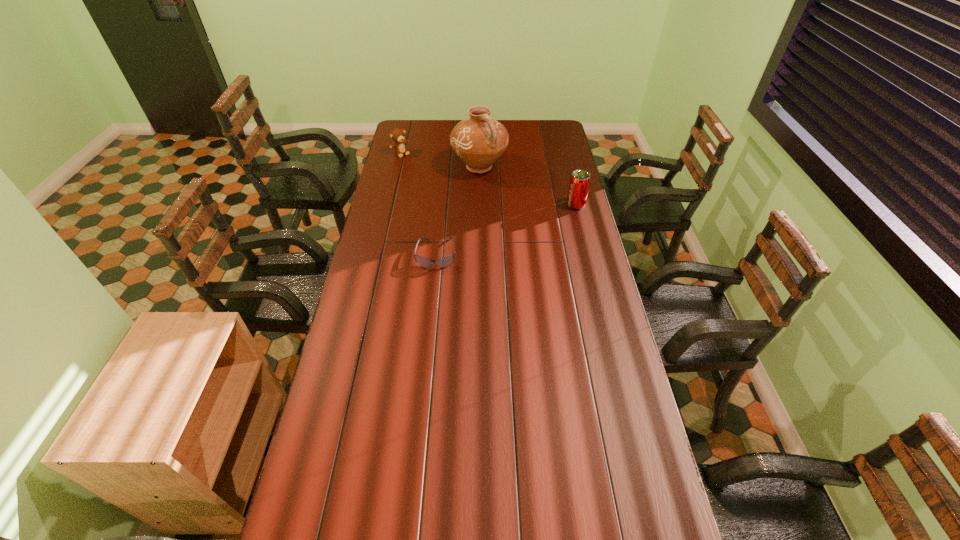
Identify the location of free space located on the face of the third tallest object. This screenshot has height=540, width=960. (442, 190).

You are a GUI agent. You are given a task and a screenshot of the screen. Output one action in this format:
    pyautogui.click(x=<x>, y=<y>)
    Task: Click on the blank space located 0.230m on the face of the third tallest object
    
    Given the screenshot: What is the action you would take?
    pyautogui.click(x=428, y=178)

Locate an element on the screen. The height and width of the screenshot is (540, 960). vacant space located on the side of the pottery with the handle is located at coordinates click(x=529, y=226).

You are a GUI agent. You are given a task and a screenshot of the screen. Output one action in this format:
    pyautogui.click(x=<x>, y=<y>)
    Task: Click on the free space located 0.050m on the side of the pottery with the handle
    The height and width of the screenshot is (540, 960).
    Given the screenshot: What is the action you would take?
    pyautogui.click(x=496, y=187)

Image resolution: width=960 pixels, height=540 pixels. What are the coordinates of `blank space located on the side of the pottery with the handle` in the screenshot? It's located at (523, 219).

This screenshot has width=960, height=540. What are the coordinates of `object present at the left edge` in the screenshot? It's located at (397, 135).

Identify the location of object that is at the right edge. (580, 180).

Where is `free space at the far edge of the desktop`? free space at the far edge of the desktop is located at coordinates (433, 120).

The image size is (960, 540). In the image, there is a desktop. What are the coordinates of `free region at the left edge` in the screenshot? It's located at (339, 422).

In the image, there is a desktop. In order to click on vacant space at the right edge in this screenshot , I will do `click(602, 364)`.